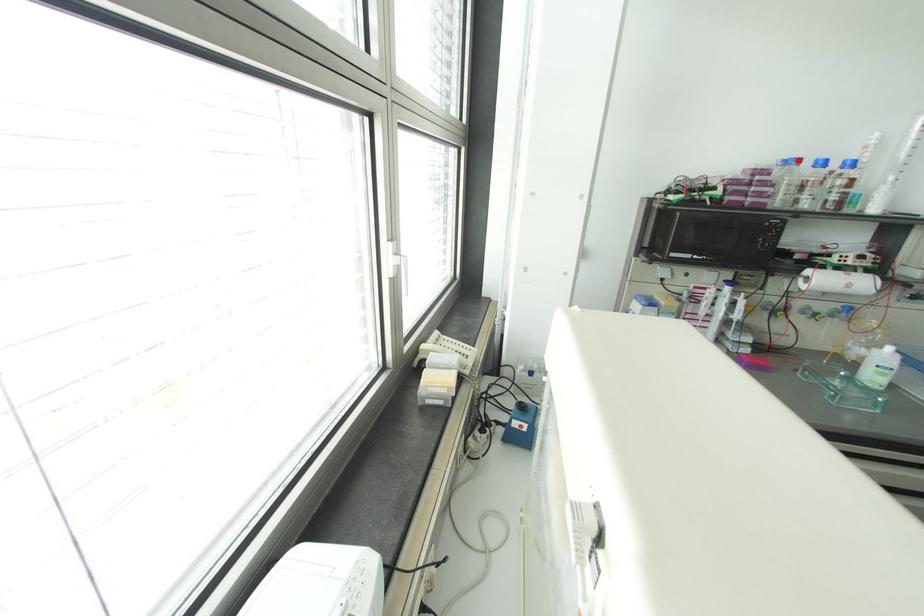
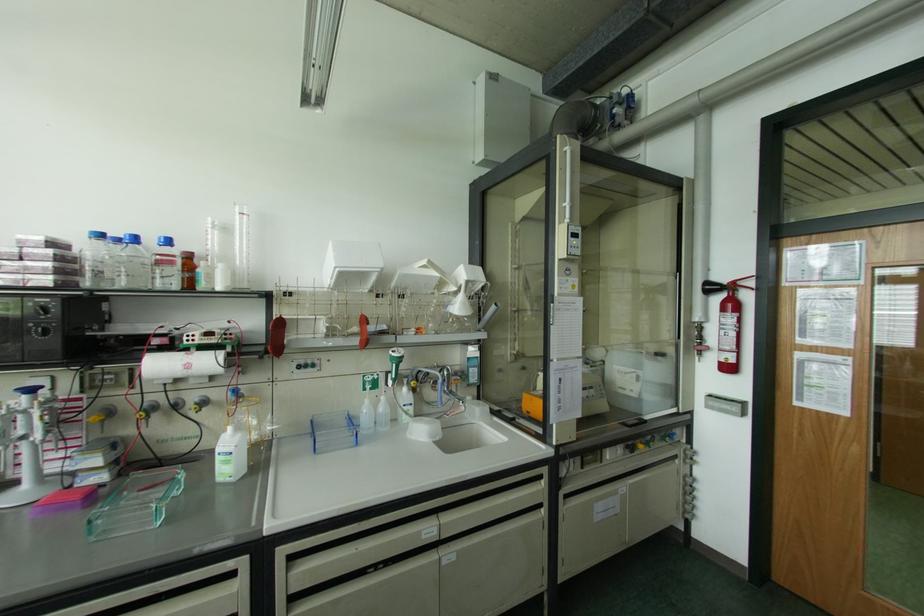
The point at the highlighted location is marked in the first image. Where is the corresponding point in the second image?

(101, 236)